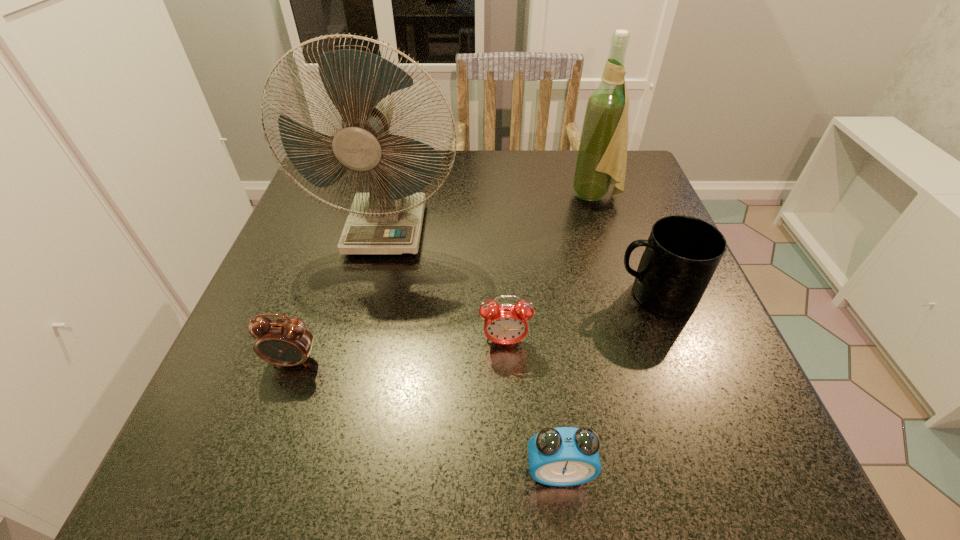
The height and width of the screenshot is (540, 960). Identify the location of vacant space in between the nearest object and the fan. (472, 350).

This screenshot has height=540, width=960. Identify the location of vacant space that's between the nearest alarm clock and the wine bottle. (577, 334).

Find the location of `blank region between the nearest alarm clock and the third nearest object`. blank region between the nearest alarm clock and the third nearest object is located at coordinates (532, 407).

The height and width of the screenshot is (540, 960). I want to click on free space between the wine bottle and the nearest alarm clock, so click(577, 334).

This screenshot has width=960, height=540. Find the location of `free area in between the third farthest object and the nearest object`. free area in between the third farthest object and the nearest object is located at coordinates (607, 383).

Image resolution: width=960 pixels, height=540 pixels. I want to click on free space between the nearest object and the mug, so click(x=607, y=383).

This screenshot has width=960, height=540. Identify the location of free space between the farthest alarm clock and the mug. (580, 319).

Locate an element on the screen. free space between the leftmost alarm clock and the fan is located at coordinates (340, 295).

I want to click on free space between the nearest alarm clock and the farthest alarm clock, so click(x=532, y=407).

Locate which object ranks second in proximity to the wine bottle. Please provide its 2D coordinates. Your answer should be formatted as a tuple, i.e. [(x, y)], where the tuple contains the x and y coordinates of a point satisfying the conditions above.

[(388, 220)]